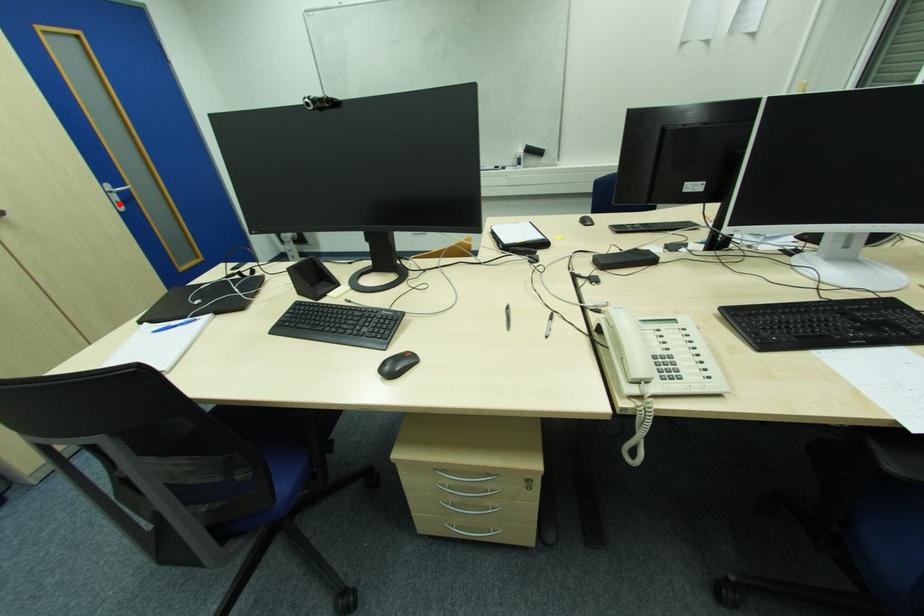
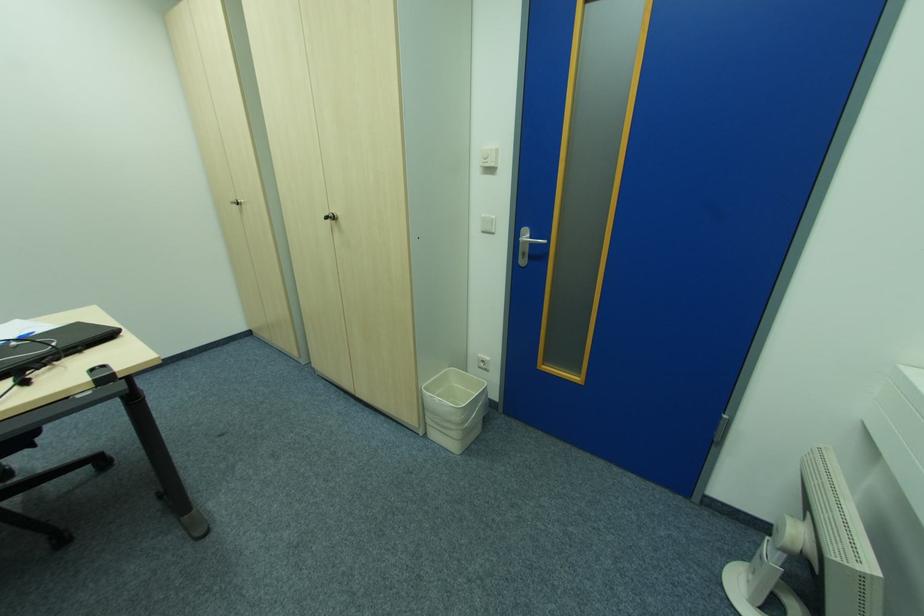
In the second image, find the point that corresponds to the highlighted location in the first image.

(526, 256)